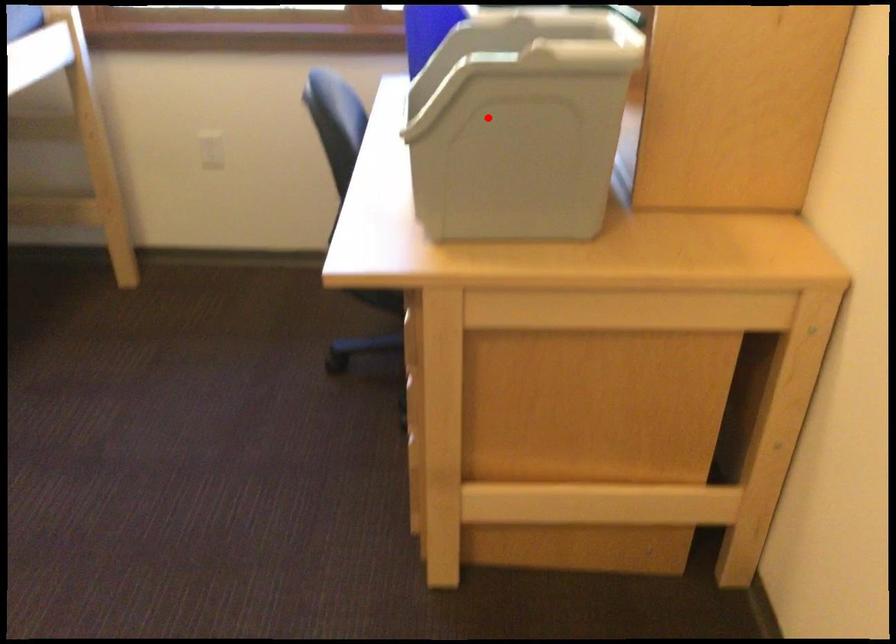
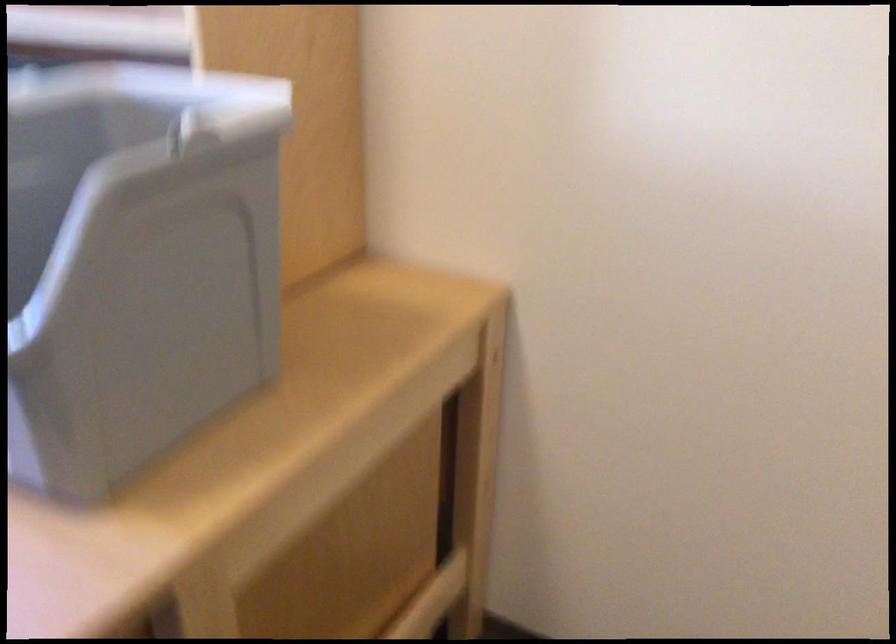
Where in the second image is the point corresponding to the highlighted location from the first image?

(135, 263)